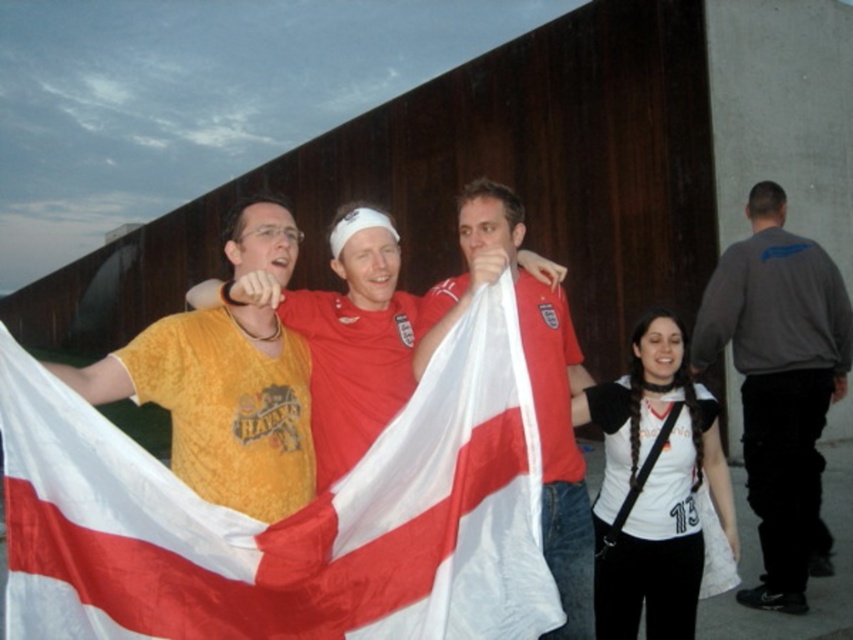
Is whitematerial/textureflag at center positioned in front of dark gray sweatshirt at right?

Yes, it is.

Is point (477, 632) positioned behind point (846, 337)?

No, (477, 632) is in front of (846, 337).

Where is `whitematerial/textureflag at center`? The image size is (853, 640). whitematerial/textureflag at center is located at coordinates (288, 518).

Does whitematerial/textureflag at center appear on the right side of matte red shirt at center?

In fact, whitematerial/textureflag at center is to the left of matte red shirt at center.

Who is more forward, (x=161, y=508) or (x=383, y=232)?

Point (x=161, y=508) is more forward.

I want to click on whitematerial/textureflag at center, so click(x=288, y=518).

Between matte red shirt at center and red fabric flag at center, which one is positioned higher?

matte red shirt at center is higher up.

Is matte red shirt at center taller than red fabric flag at center?

Incorrect, matte red shirt at center's height is not larger of red fabric flag at center's.

Locate an element on the screen. matte red shirt at center is located at coordinates (345, 337).

Find the location of a particular element. matte red shirt at center is located at coordinates (345, 337).